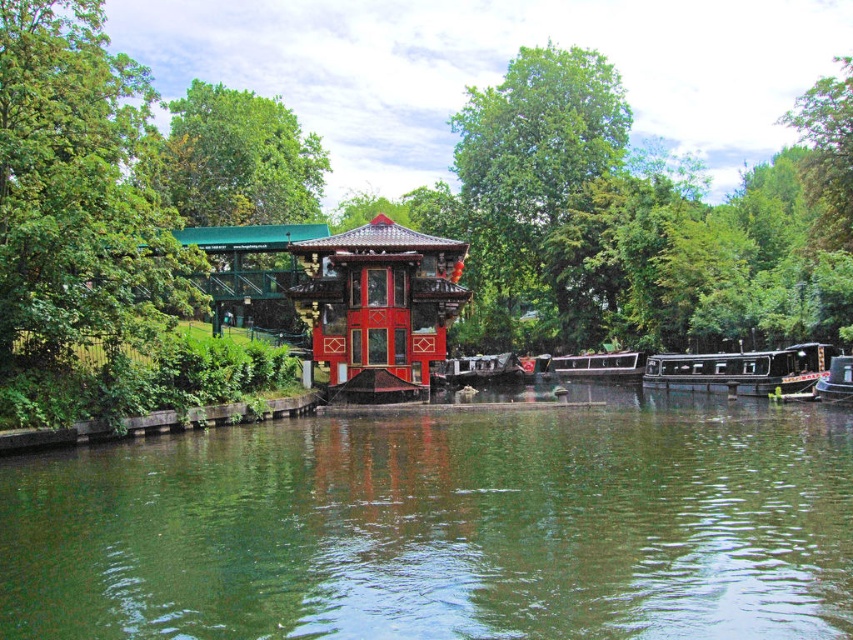
Who is shorter, green leafy tree at left or black polished wood barge at lower right?

With less height is black polished wood barge at lower right.

From the picture: How far apart are green leafy tree at left and black polished wood barge at lower right?

green leafy tree at left is 67.36 meters from black polished wood barge at lower right.

Is point (10, 20) positioned in front of point (817, 387)?

Yes, point (10, 20) is closer to viewer.

You are a GUI agent. You are given a task and a screenshot of the screen. Output one action in this format:
    pyautogui.click(x=<x>, y=<y>)
    Task: Click on the green leafy tree at left
    Image resolution: width=853 pixels, height=640 pixels.
    Given the screenshot: What is the action you would take?
    pyautogui.click(x=79, y=195)

Who is positioned more to the left, green smooth water at center or black polished wood barge at lower right?

green smooth water at center

This screenshot has height=640, width=853. Describe the element at coordinates (444, 525) in the screenshot. I see `green smooth water at center` at that location.

The width and height of the screenshot is (853, 640). What are the coordinates of `green smooth water at center` in the screenshot? It's located at (444, 525).

Locate an element on the screen. The height and width of the screenshot is (640, 853). green leafy tree at left is located at coordinates (79, 195).

Find the location of a particular element. green leafy tree at left is located at coordinates coord(79,195).